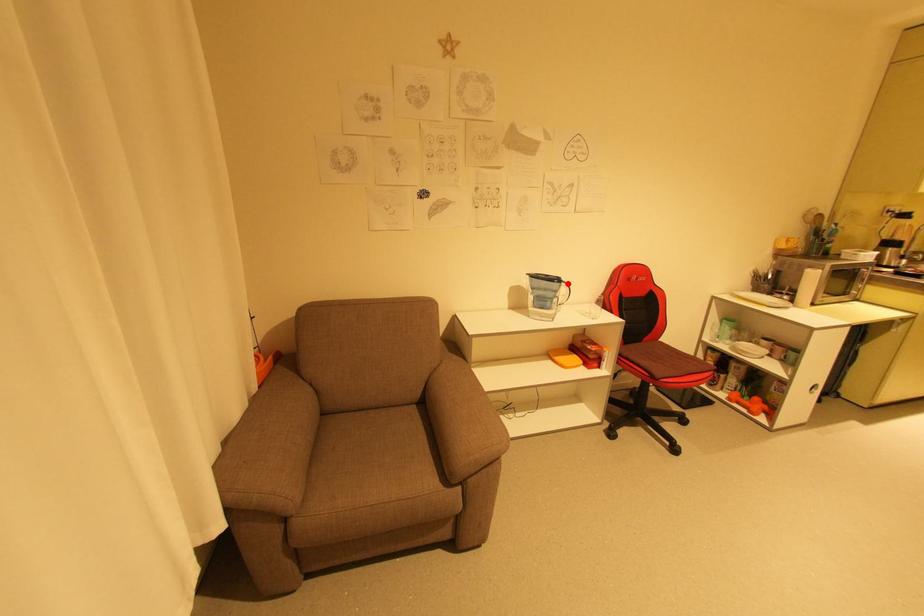
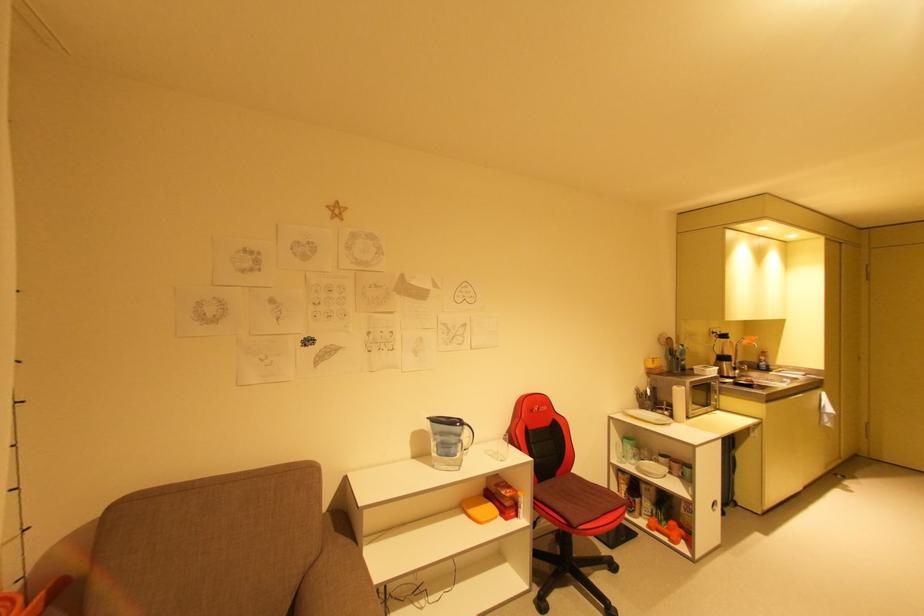
In the second image, find the point that corresponds to the highlighted location in the first image.

(469, 427)